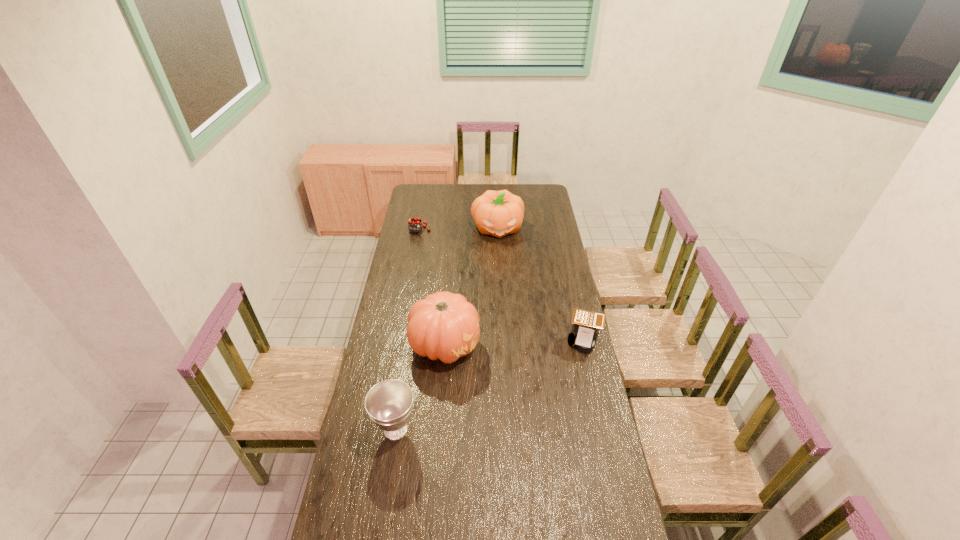
Identify the location of free spot on the desktop that is between the third shortest object and the calculator and is positioned on the handle side of the pot filled with cherries. (511, 375).

The width and height of the screenshot is (960, 540). I want to click on free space on the desktop that is between the third shortest object and the calculator and is positioned on the carved face of the farther pumpkin, so click(x=519, y=371).

Locate an element on the screen. The height and width of the screenshot is (540, 960). free space on the desktop that is between the third tallest object and the calculator and is positioned on the carved face of the nearer pumpkin is located at coordinates (525, 368).